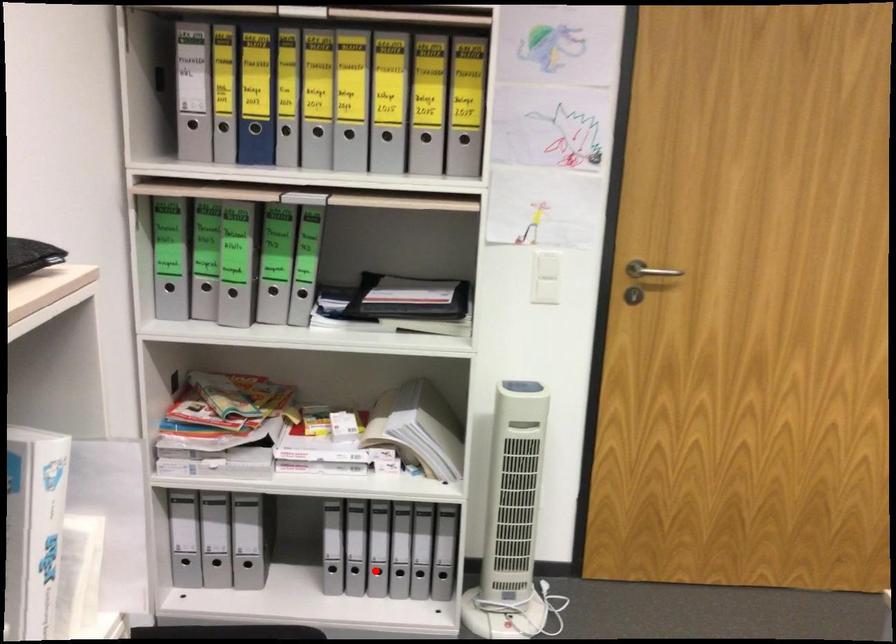
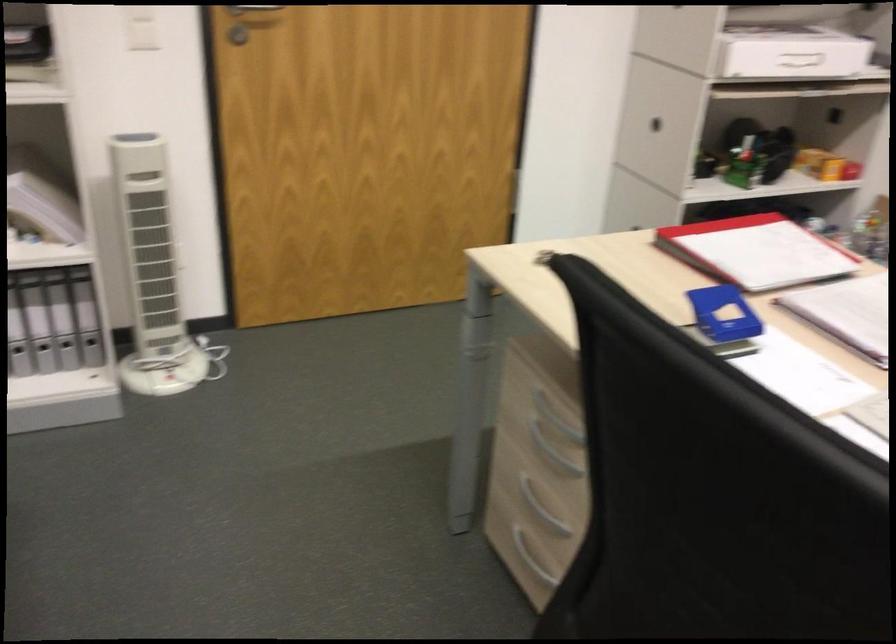
Find the pixel in the second image that matches the highlighted location in the first image.

(16, 348)